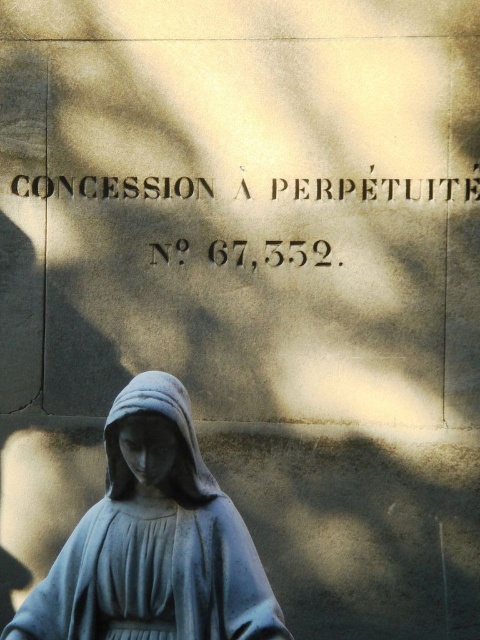
Question: Among these objects, which one is farthest from the camera?

Choices:
 (A) dark gray stone inscription at upper center
 (B) gray stone statue at center

Answer: (A)

Question: Does gray stone statue at lower center appear under dark gray stone inscription at upper center?

Choices:
 (A) yes
 (B) no

Answer: (A)

Question: Which object is positioned closest to the gray stone statue at center?

Choices:
 (A) dark gray stone inscription at upper center
 (B) gray stone statue at lower center

Answer: (B)

Question: Does gray stone statue at lower center come in front of dark gray stone inscription at upper center?

Choices:
 (A) yes
 (B) no

Answer: (A)

Question: Can you confirm if gray stone statue at lower center is wider than gray stone statue at center?

Choices:
 (A) no
 (B) yes

Answer: (B)

Question: Which object is farther from the camera taking this photo?

Choices:
 (A) gray stone statue at center
 (B) dark gray stone inscription at upper center

Answer: (B)